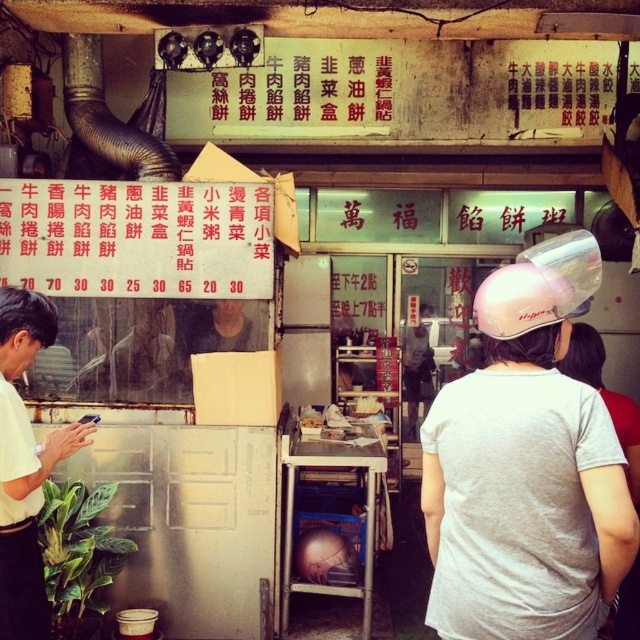
Based on the photo, is pink matte helmet at upper center above white matte shirt at left?

Correct, pink matte helmet at upper center is located above white matte shirt at left.

Can you confirm if pink matte helmet at upper center is thinner than white matte shirt at left?

Incorrect, pink matte helmet at upper center's width is not less than white matte shirt at left's.

Which is in front, point (545, 432) or point (58, 460)?

Point (545, 432) is in front.

Locate an element on the screen. Image resolution: width=640 pixels, height=640 pixels. pink matte helmet at upper center is located at coordinates (522, 493).

Is red paper menu at center positioned at the back of white matte shirt at left?

Yes, it is.

Which is more to the right, red paper menu at center or white matte shirt at left?

red paper menu at center is more to the right.

Where is `red paper menu at center`? The height and width of the screenshot is (640, 640). red paper menu at center is located at coordinates (136, 237).

Is pink matte helmet at upper center bigger than red paper menu at center?

Indeed, pink matte helmet at upper center has a larger size compared to red paper menu at center.

Between point (564, 486) and point (268, 241), which one is positioned behind?

The point (268, 241) is behind.

Identify the location of pink matte helmet at upper center. (522, 493).